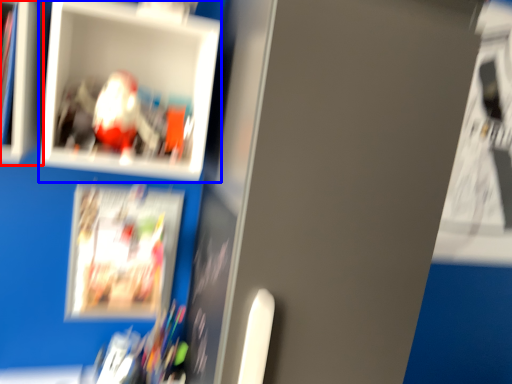
Question: Among these objects, which one is farthest to the camera, cabinet (highlighted by a red box) or picture frame (highlighted by a blue box)?

Choices:
 (A) cabinet
 (B) picture frame

Answer: (B)